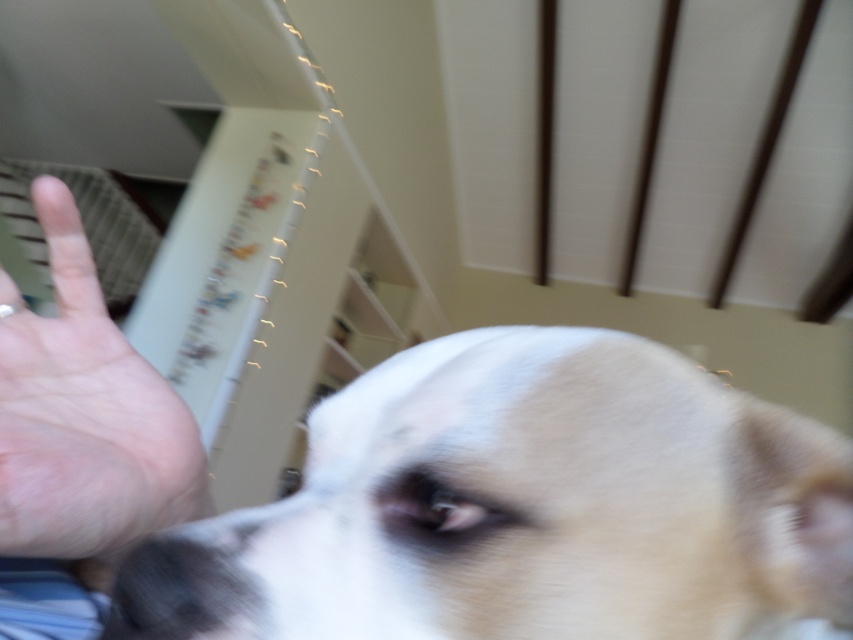
Is white fur dog at center to the left of pale skin palm at upper left from the viewer's perspective?

No, white fur dog at center is not to the left of pale skin palm at upper left.

Is point (804, 602) less distant than point (107, 461)?

Yes, point (804, 602) is closer to viewer.

This screenshot has height=640, width=853. Find the location of `white fur dog at center`. white fur dog at center is located at coordinates (523, 508).